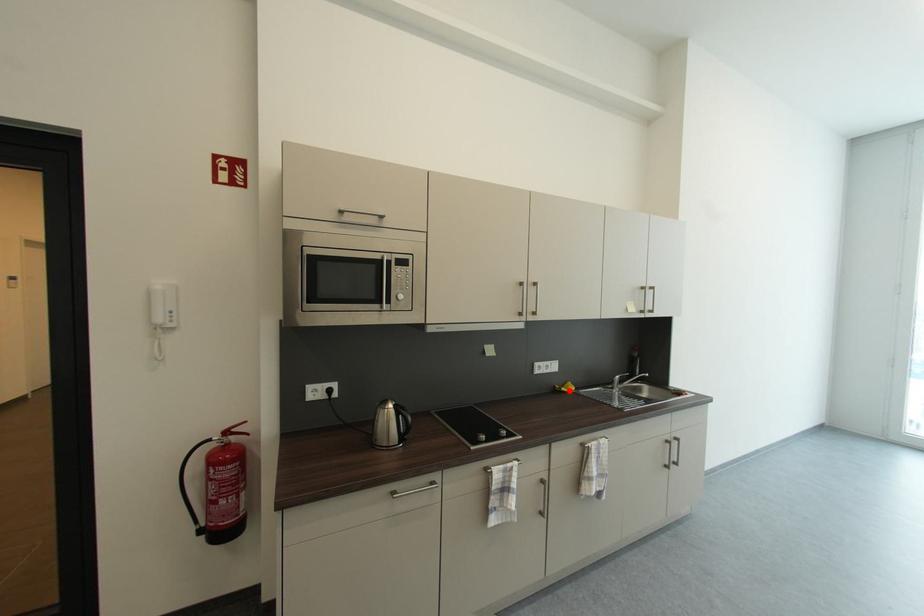
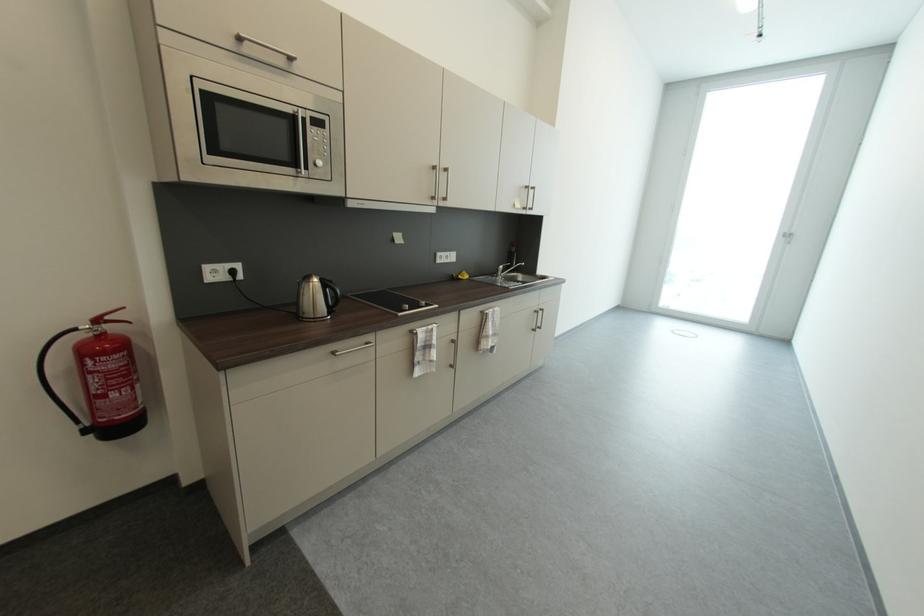
The point at the highlighted location is marked in the first image. Where is the corresponding point in the second image?

(467, 278)